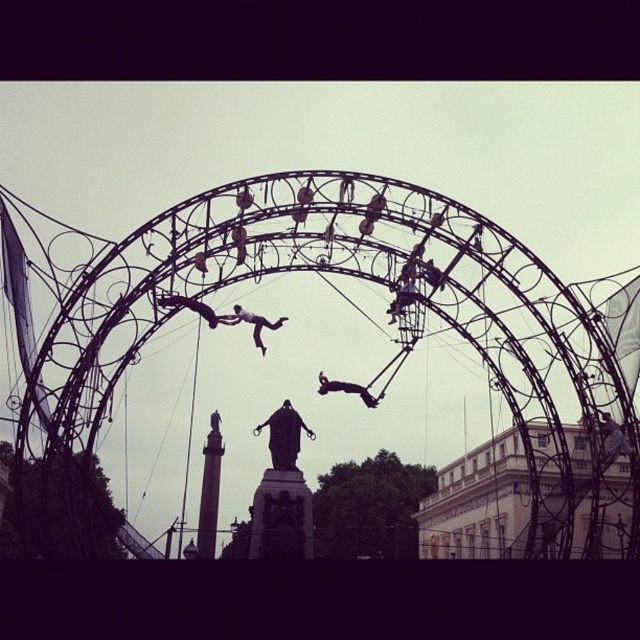
You are standing in the scene and want to take a photo of the metallic silver statue at center. Considering the distance between you and the statue, will you need a zoom lens to capture the entire statue in your photo?

The metallic silver statue at center is 143.06 meters away from the viewer. Since this distance is quite far, you would likely need a zoom lens to ensure the entire statue fits within the frame of your photo.

You are an architect analyzing the spatial arrangement of the scene. Based on the image, which object is positioned higher in the frame between the polished bronze statue at center and the metallic wire figure at center?

The metallic wire figure at center is positioned higher than the polished bronze statue at center in the frame.